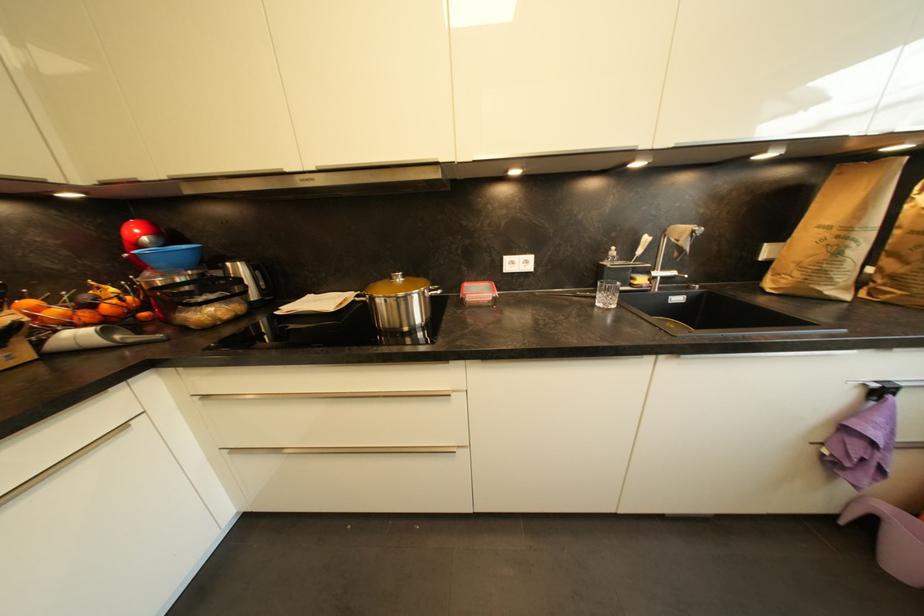
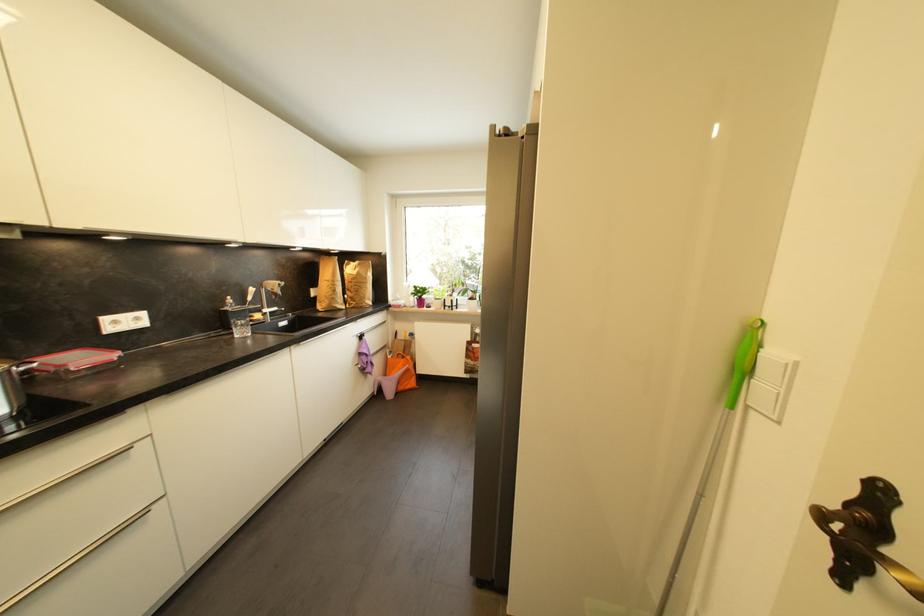
Locate, in the second image, the point that corresponds to point 610,302 in the first image.

(247, 334)